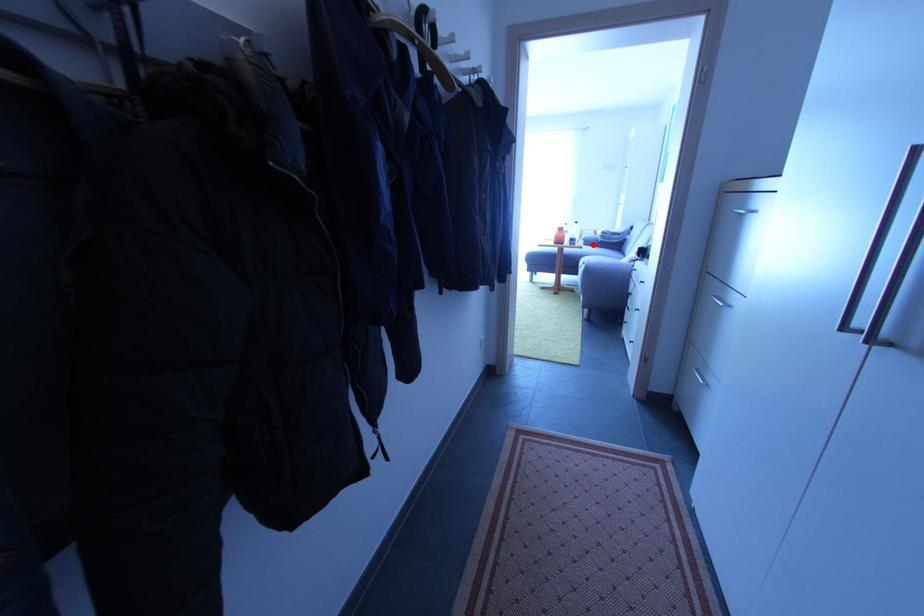
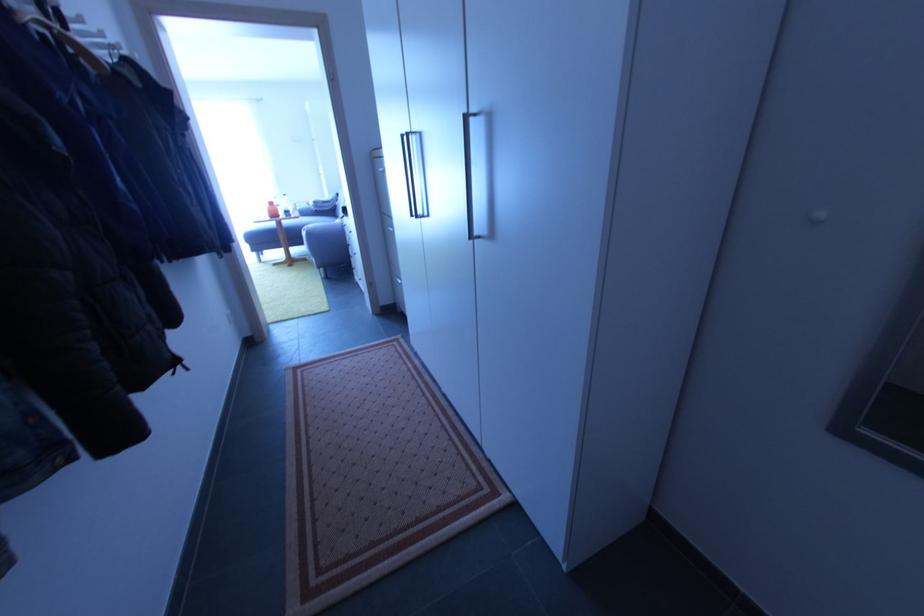
The point at the highlighted location is marked in the first image. Where is the corresponding point in the second image?

(310, 216)